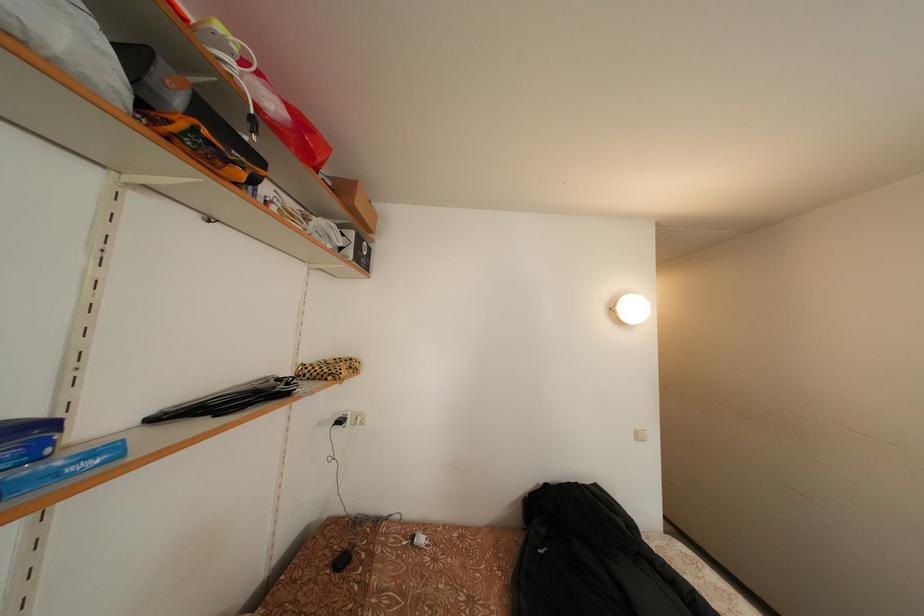
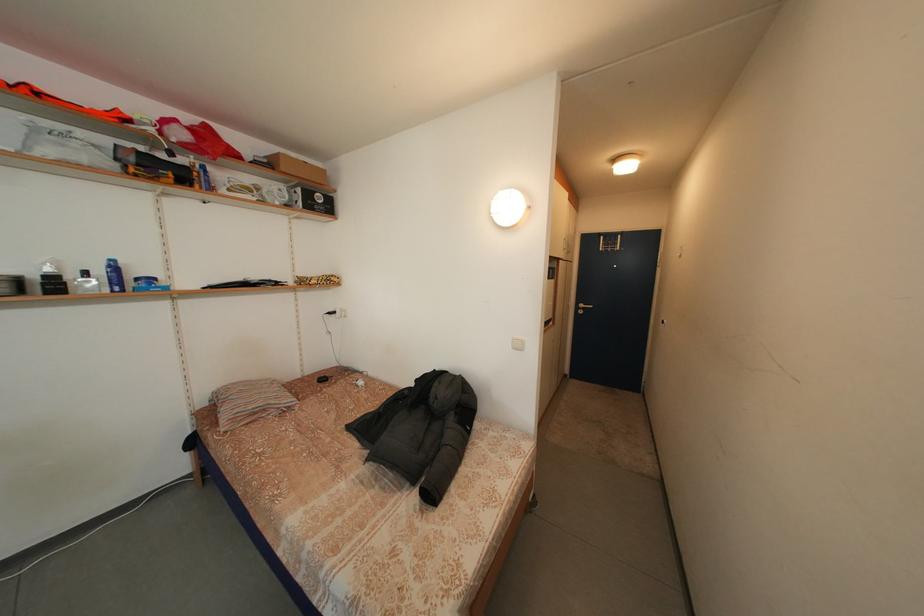
Find the pixel in the second image that matches (x=359, y=238) in the first image.

(307, 196)